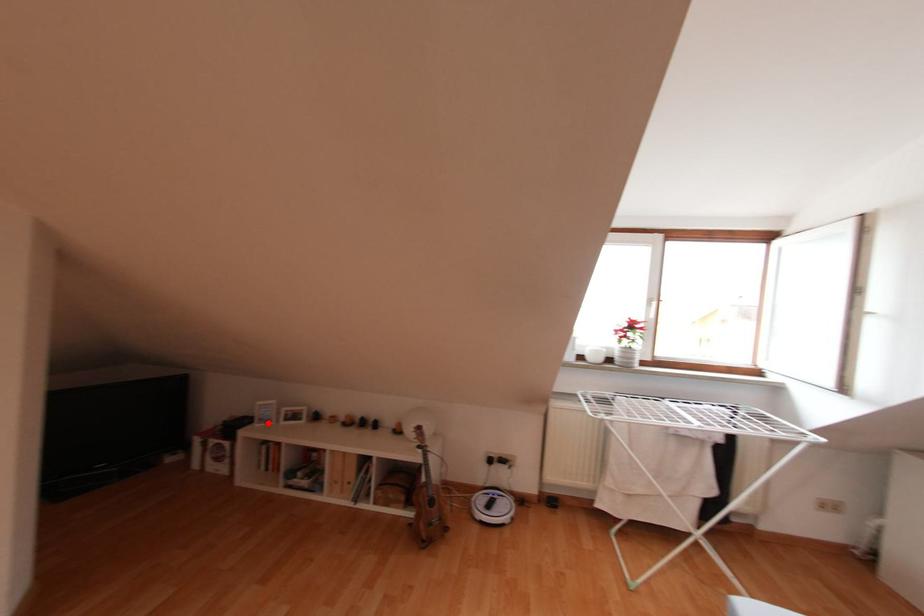
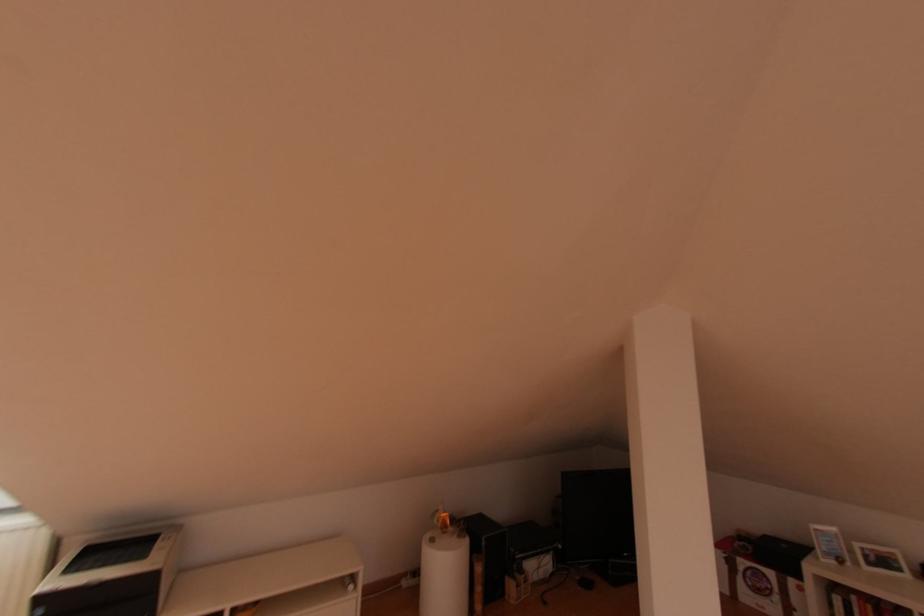
Question: I am providing you with two images of the same scene from different viewpoints. In image1, a red point is highlighted. Considering the same 3D point in image2, which of the following is correct?

Choices:
 (A) It is closer
 (B) It is farther

Answer: (A)